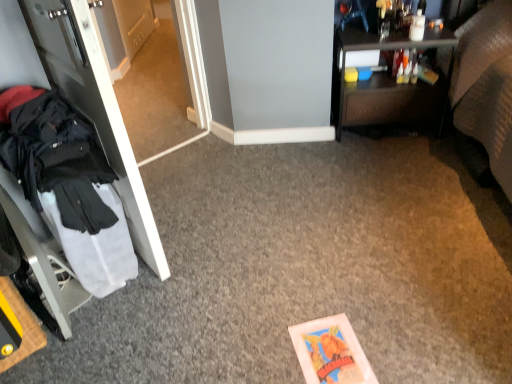
Question: Does dark brown wood desk at upper right have a smaller size compared to transparent glass door at left?

Choices:
 (A) no
 (B) yes

Answer: (A)

Question: Is there a large distance between dark brown wood desk at upper right and transparent glass door at left?

Choices:
 (A) yes
 (B) no

Answer: (A)

Question: Does dark brown wood desk at upper right appear on the right side of transparent glass door at left?

Choices:
 (A) no
 (B) yes

Answer: (B)

Question: Considering the relative sizes of dark brown wood desk at upper right and transparent glass door at left in the image provided, is dark brown wood desk at upper right shorter than transparent glass door at left?

Choices:
 (A) no
 (B) yes

Answer: (B)

Question: From the image's perspective, is dark brown wood desk at upper right above transparent glass door at left?

Choices:
 (A) yes
 (B) no

Answer: (B)

Question: From the image's perspective, is dark brown wood desk at upper right located beneath transparent glass door at left?

Choices:
 (A) yes
 (B) no

Answer: (A)

Question: Can you see white glossy door at left touching black fabric coat at left?

Choices:
 (A) no
 (B) yes

Answer: (A)

Question: From the image's perspective, is white glossy door at left located above black fabric coat at left?

Choices:
 (A) no
 (B) yes

Answer: (B)

Question: Is white glossy door at left facing away from black fabric coat at left?

Choices:
 (A) yes
 (B) no

Answer: (A)

Question: Are white glossy door at left and black fabric coat at left located far from each other?

Choices:
 (A) yes
 (B) no

Answer: (B)

Question: Considering the relative sizes of white glossy door at left and black fabric coat at left in the image provided, is white glossy door at left taller than black fabric coat at left?

Choices:
 (A) yes
 (B) no

Answer: (A)

Question: Is white glossy door at left not inside black fabric coat at left?

Choices:
 (A) no
 (B) yes

Answer: (B)

Question: Is transparent glass door at left positioned beyond the bounds of dark brown wood desk at upper right?

Choices:
 (A) yes
 (B) no

Answer: (A)